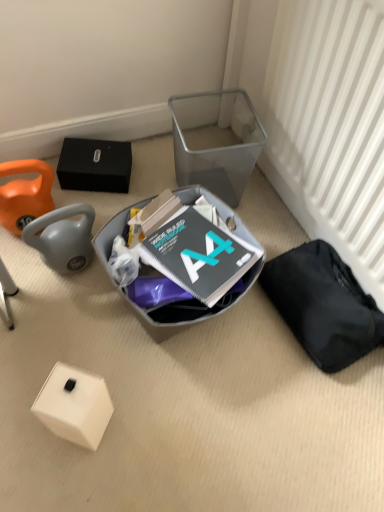
Question: Does matte gray plastic bin at center, marked as the 1th waste in a left-to-right arrangement, have a greater height compared to black fabric bag at lower right, the 2th waste in the left-to-right sequence?

Choices:
 (A) yes
 (B) no

Answer: (A)

Question: Is matte gray plastic bin at center, marked as the 1th waste in a left-to-right arrangement, bigger than black fabric bag at lower right, acting as the 1th waste starting from the right?

Choices:
 (A) yes
 (B) no

Answer: (A)

Question: Considering the relative sizes of matte gray plastic bin at center, marked as the 1th waste in a left-to-right arrangement, and black fabric bag at lower right, acting as the 1th waste starting from the right, in the image provided, is matte gray plastic bin at center, marked as the 1th waste in a left-to-right arrangement, shorter than black fabric bag at lower right, acting as the 1th waste starting from the right,?

Choices:
 (A) no
 (B) yes

Answer: (A)

Question: Is the depth of matte gray plastic bin at center, marked as the 1th waste in a left-to-right arrangement, greater than that of black fabric bag at lower right, acting as the 1th waste starting from the right?

Choices:
 (A) no
 (B) yes

Answer: (A)

Question: Is matte gray plastic bin at center, which appears as the second waste when viewed from the right, in front of black fabric bag at lower right, the 2th waste in the left-to-right sequence?

Choices:
 (A) no
 (B) yes

Answer: (B)

Question: Does point (347, 146) appear closer or farther from the camera than point (147, 200)?

Choices:
 (A) closer
 (B) farther

Answer: (A)

Question: Is white textured radiator at right wider or thinner than matte gray plastic bin at center, which appears as the second waste when viewed from the right?

Choices:
 (A) thin
 (B) wide

Answer: (A)

Question: Is white textured radiator at right inside the boundaries of matte gray plastic bin at center, marked as the 1th waste in a left-to-right arrangement, or outside?

Choices:
 (A) inside
 (B) outside

Answer: (B)

Question: Considering the relative positions of white textured radiator at right and matte gray plastic bin at center, which appears as the second waste when viewed from the right, in the image provided, is white textured radiator at right to the left or to the right of matte gray plastic bin at center, which appears as the second waste when viewed from the right,?

Choices:
 (A) left
 (B) right

Answer: (B)

Question: From the image's perspective, relative to white textured radiator at right, is white matte box at lower left above or below?

Choices:
 (A) above
 (B) below

Answer: (B)

Question: Considering the positions of white matte box at lower left and white textured radiator at right in the image, is white matte box at lower left taller or shorter than white textured radiator at right?

Choices:
 (A) short
 (B) tall

Answer: (A)

Question: Is white matte box at lower left situated inside white textured radiator at right or outside?

Choices:
 (A) outside
 (B) inside

Answer: (A)

Question: From a real-world perspective, is white matte box at lower left above or below white textured radiator at right?

Choices:
 (A) above
 (B) below

Answer: (B)

Question: Is point (57, 393) positioned closer to the camera than point (238, 222)?

Choices:
 (A) farther
 (B) closer

Answer: (B)

Question: Considering the positions of white matte box at lower left and matte gray plastic bin at center, which appears as the second waste when viewed from the right, in the image, is white matte box at lower left taller or shorter than matte gray plastic bin at center, which appears as the second waste when viewed from the right,?

Choices:
 (A) short
 (B) tall

Answer: (A)